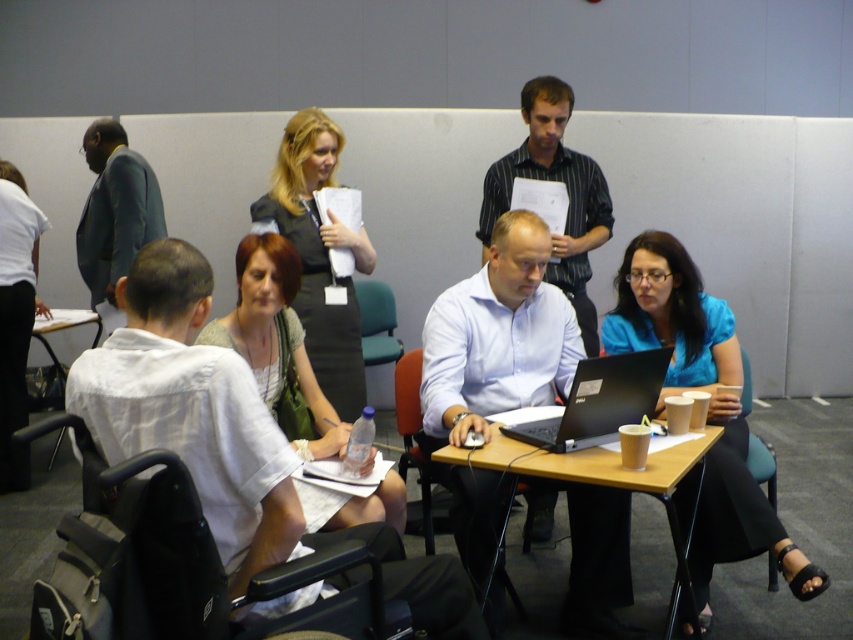
You are planning to place a new rectangular desk between the matte white shirt at center and the red leather chair at center. The desk requires at least 1.2 meters of space between them to fit properly. Can you determine if there is enough space based on their current positions?

The matte white shirt at center might be wider than red leather chair at center, but the description does not provide exact measurements of the distance between them. Therefore, it is unclear if there is sufficient space for the desk.

You are organizing a space for a meeting and need to ensure there is enough room for the black plastic wheelchair at lower left and the white fabric shirt at left. Based on the scene, which object requires more horizontal space?

The black plastic wheelchair at lower left requires more horizontal space because its width surpasses that of the white fabric shirt at left.